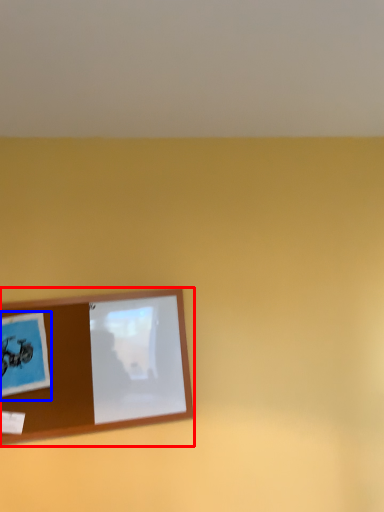
Question: Which of the following is the farthest to the observer, picture frame (highlighted by a red box) or postcard (highlighted by a blue box)?

Choices:
 (A) picture frame
 (B) postcard

Answer: (A)